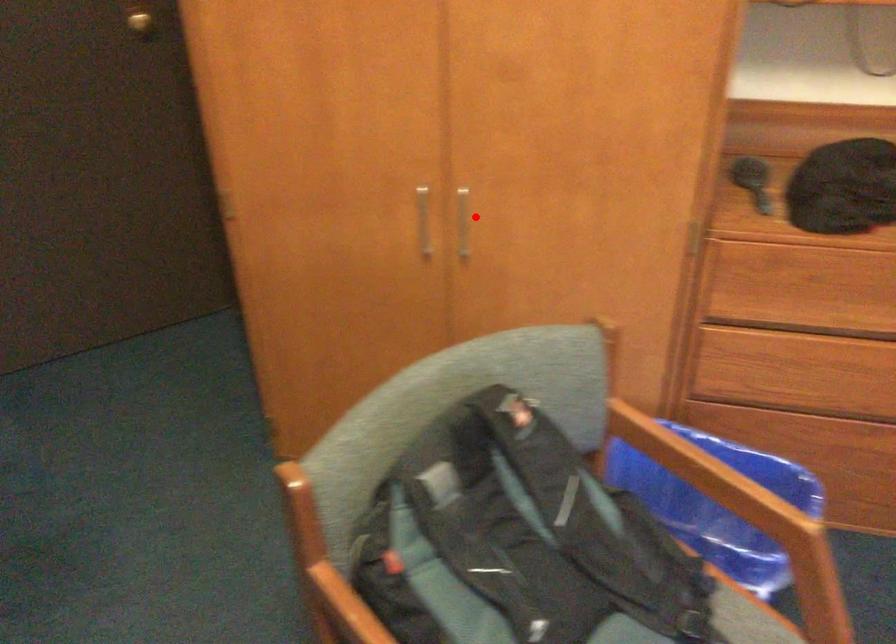
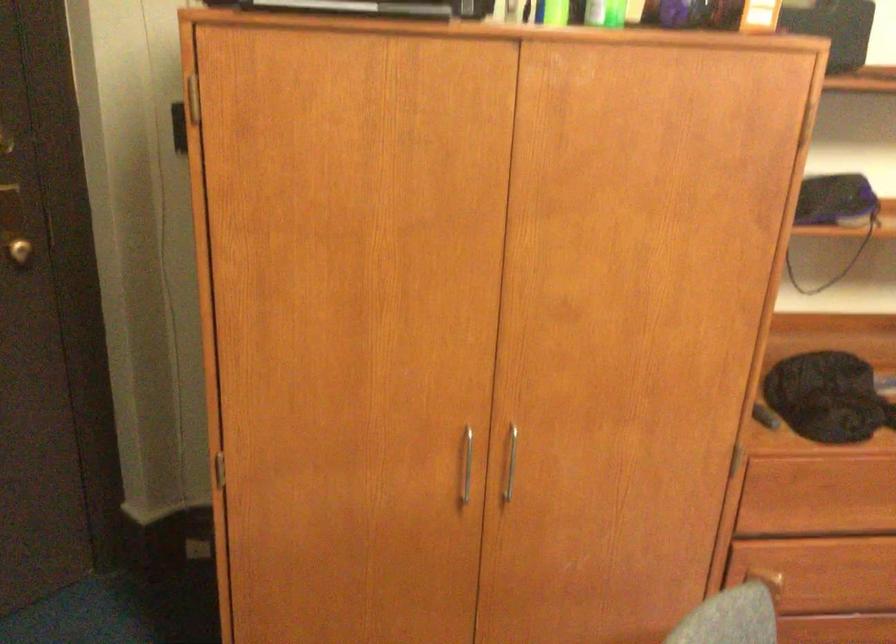
The point at the highlighted location is marked in the first image. Where is the corresponding point in the second image?

(511, 462)